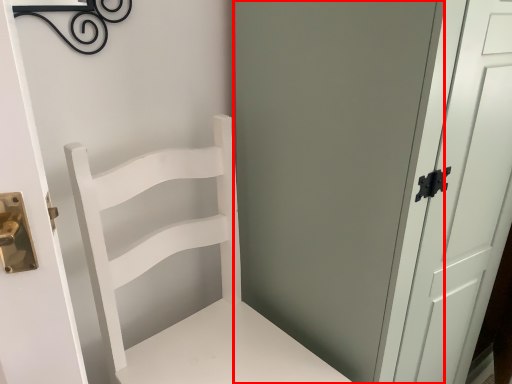
Question: From the image's perspective, where is screen door (annotated by the red box) located in relation to chair in the image?

Choices:
 (A) above
 (B) below

Answer: (A)